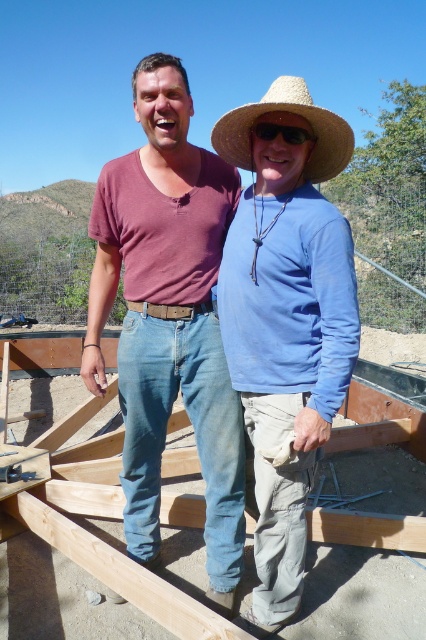
Question: Which point is farther to the camera?

Choices:
 (A) (176, 160)
 (B) (275, 131)
 (C) (226, 134)

Answer: (A)

Question: Considering the relative positions of matte brown shirt at center and matte straw hat at center in the image provided, where is matte brown shirt at center located with respect to matte straw hat at center?

Choices:
 (A) above
 (B) below

Answer: (A)

Question: Does matte brown shirt at center have a smaller size compared to straw hat at center?

Choices:
 (A) yes
 (B) no

Answer: (B)

Question: Which of the following is the closest to the observer?

Choices:
 (A) (195, 186)
 (B) (247, 116)

Answer: (B)

Question: Which is farther from the matte straw hat at center?

Choices:
 (A) matte brown shirt at center
 (B) straw hat at center

Answer: (B)

Question: From the image, what is the correct spatial relationship of matte straw hat at center in relation to straw hat at center?

Choices:
 (A) right
 (B) left

Answer: (A)